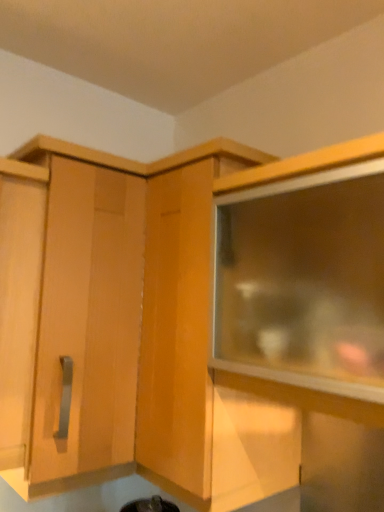
Describe the element at coordinates (304, 281) in the screenshot. I see `transparent glass cabinet at upper right` at that location.

At what (x,y) coordinates should I click in order to perform the action: click on wooden cabinet at center, the 1th cabinetry viewed from the right. Please return your answer as a coordinate pair (x, y). Looking at the image, I should click on (129, 322).

Locate an element on the screen. Image resolution: width=384 pixels, height=512 pixels. matte wood cabinet at upper left, the 2th cabinetry viewed from the right is located at coordinates (88, 321).

Identify the location of transparent glass cabinet at upper right. The width and height of the screenshot is (384, 512). (304, 281).

Measure the distance from transparent glass cabinet at upper right to matte wood cabinet at upper left, placed as the first cabinetry when sorted from left to right.

transparent glass cabinet at upper right and matte wood cabinet at upper left, placed as the first cabinetry when sorted from left to right, are 38.91 centimeters apart.

From a real-world perspective, does transparent glass cabinet at upper right sit lower than matte wood cabinet at upper left, the 2th cabinetry viewed from the right?

No, from a real-world perspective, transparent glass cabinet at upper right is not below matte wood cabinet at upper left, the 2th cabinetry viewed from the right.

Find the location of a particular element. cabinetry that is the 2nd one when counting leftward from the transparent glass cabinet at upper right is located at coordinates (88, 321).

Looking at the image, does transparent glass cabinet at upper right seem bigger or smaller compared to matte wood cabinet at upper left, placed as the first cabinetry when sorted from left to right?

Clearly, transparent glass cabinet at upper right is smaller in size than matte wood cabinet at upper left, placed as the first cabinetry when sorted from left to right.

The image size is (384, 512). Identify the location of cabinetry on the right of matte wood cabinet at upper left, placed as the first cabinetry when sorted from left to right. (129, 322).

Is wooden cabinet at center, the 2th cabinetry viewed from the left, positioned with its back to matte wood cabinet at upper left, placed as the first cabinetry when sorted from left to right?

Absolutely, wooden cabinet at center, the 2th cabinetry viewed from the left, is directed away from matte wood cabinet at upper left, placed as the first cabinetry when sorted from left to right.

Is wooden cabinet at center, the 1th cabinetry viewed from the right, taller than matte wood cabinet at upper left, the 2th cabinetry viewed from the right?

Correct, wooden cabinet at center, the 1th cabinetry viewed from the right, is much taller as matte wood cabinet at upper left, the 2th cabinetry viewed from the right.

From a real-world perspective, is wooden cabinet at center, the 2th cabinetry viewed from the left, positioned above or below matte wood cabinet at upper left, the 2th cabinetry viewed from the right?

wooden cabinet at center, the 2th cabinetry viewed from the left, is below matte wood cabinet at upper left, the 2th cabinetry viewed from the right.

Would you consider matte wood cabinet at upper left, the 2th cabinetry viewed from the right, to be distant from wooden cabinet at center, the 1th cabinetry viewed from the right?

matte wood cabinet at upper left, the 2th cabinetry viewed from the right, is near wooden cabinet at center, the 1th cabinetry viewed from the right, not far away.

This screenshot has width=384, height=512. Find the location of `cabinetry on the left of wooden cabinet at center, the 1th cabinetry viewed from the right`. cabinetry on the left of wooden cabinet at center, the 1th cabinetry viewed from the right is located at coordinates (88, 321).

From the image's perspective, which one is positioned lower, matte wood cabinet at upper left, placed as the first cabinetry when sorted from left to right, or wooden cabinet at center, the 2th cabinetry viewed from the left?

wooden cabinet at center, the 2th cabinetry viewed from the left, appears lower in the image.

From the image's perspective, is matte wood cabinet at upper left, placed as the first cabinetry when sorted from left to right, on transparent glass cabinet at upper right?

No, from the image's perspective, matte wood cabinet at upper left, placed as the first cabinetry when sorted from left to right, is not on top of transparent glass cabinet at upper right.

Considering the sizes of matte wood cabinet at upper left, the 2th cabinetry viewed from the right, and transparent glass cabinet at upper right in the image, is matte wood cabinet at upper left, the 2th cabinetry viewed from the right, taller or shorter than transparent glass cabinet at upper right?

In the image, matte wood cabinet at upper left, the 2th cabinetry viewed from the right, appears to be taller than transparent glass cabinet at upper right.

Is matte wood cabinet at upper left, placed as the first cabinetry when sorted from left to right, not inside transparent glass cabinet at upper right?

Yes, matte wood cabinet at upper left, placed as the first cabinetry when sorted from left to right, is not within transparent glass cabinet at upper right.

Is matte wood cabinet at upper left, the 2th cabinetry viewed from the right, in contact with transparent glass cabinet at upper right?

No, matte wood cabinet at upper left, the 2th cabinetry viewed from the right, is not in contact with transparent glass cabinet at upper right.

Is point (284, 180) farther from camera compared to point (102, 433)?

No, (284, 180) is in front of (102, 433).

Looking at this image, could you tell me if transparent glass cabinet at upper right is facing wooden cabinet at center, the 2th cabinetry viewed from the left?

No, transparent glass cabinet at upper right is not aimed at wooden cabinet at center, the 2th cabinetry viewed from the left.

Which object is positioned more to the left, transparent glass cabinet at upper right or wooden cabinet at center, the 1th cabinetry viewed from the right?

Positioned to the left is wooden cabinet at center, the 1th cabinetry viewed from the right.

In the scene shown: From the image's perspective, does transparent glass cabinet at upper right appear higher than wooden cabinet at center, the 1th cabinetry viewed from the right?

Correct, transparent glass cabinet at upper right appears higher than wooden cabinet at center, the 1th cabinetry viewed from the right, in the image.

Is transparent glass cabinet at upper right surrounded by wooden cabinet at center, the 1th cabinetry viewed from the right?

No, transparent glass cabinet at upper right is not surrounded by wooden cabinet at center, the 1th cabinetry viewed from the right.

Between wooden cabinet at center, the 1th cabinetry viewed from the right, and transparent glass cabinet at upper right, which one has less height?

transparent glass cabinet at upper right is shorter.

Considering the relative positions of wooden cabinet at center, the 2th cabinetry viewed from the left, and transparent glass cabinet at upper right in the image provided, is wooden cabinet at center, the 2th cabinetry viewed from the left, in front of transparent glass cabinet at upper right?

That is False.

Where is `window that appears above the wooden cabinet at center, the 1th cabinetry viewed from the right (from a real-world perspective)`? The image size is (384, 512). window that appears above the wooden cabinet at center, the 1th cabinetry viewed from the right (from a real-world perspective) is located at coordinates (304, 281).

Identify the location of window above the matte wood cabinet at upper left, placed as the first cabinetry when sorted from left to right (from a real-world perspective). The image size is (384, 512). (304, 281).

Identify the location of cabinetry below the matte wood cabinet at upper left, placed as the first cabinetry when sorted from left to right (from a real-world perspective). (129, 322).

Considering their positions, is wooden cabinet at center, the 1th cabinetry viewed from the right, positioned further to transparent glass cabinet at upper right than matte wood cabinet at upper left, the 2th cabinetry viewed from the right?

matte wood cabinet at upper left, the 2th cabinetry viewed from the right, is further to transparent glass cabinet at upper right.

Looking at the image, which one is located closer to matte wood cabinet at upper left, placed as the first cabinetry when sorted from left to right, wooden cabinet at center, the 1th cabinetry viewed from the right, or transparent glass cabinet at upper right?

wooden cabinet at center, the 1th cabinetry viewed from the right, is positioned closer to the anchor matte wood cabinet at upper left, placed as the first cabinetry when sorted from left to right.

Considering their positions, is matte wood cabinet at upper left, placed as the first cabinetry when sorted from left to right, positioned closer to transparent glass cabinet at upper right than wooden cabinet at center, the 1th cabinetry viewed from the right?

The object closer to transparent glass cabinet at upper right is wooden cabinet at center, the 1th cabinetry viewed from the right.

Which object lies further to the anchor point wooden cabinet at center, the 1th cabinetry viewed from the right, matte wood cabinet at upper left, the 2th cabinetry viewed from the right, or transparent glass cabinet at upper right?

transparent glass cabinet at upper right is further to wooden cabinet at center, the 1th cabinetry viewed from the right.

Based on their spatial positions, is transparent glass cabinet at upper right or wooden cabinet at center, the 2th cabinetry viewed from the left, further from matte wood cabinet at upper left, the 2th cabinetry viewed from the right?

transparent glass cabinet at upper right is further to matte wood cabinet at upper left, the 2th cabinetry viewed from the right.

Considering their positions, is transparent glass cabinet at upper right positioned further to wooden cabinet at center, the 1th cabinetry viewed from the right, than matte wood cabinet at upper left, the 2th cabinetry viewed from the right?

Based on the image, transparent glass cabinet at upper right appears to be further to wooden cabinet at center, the 1th cabinetry viewed from the right.

I want to click on cabinetry between matte wood cabinet at upper left, placed as the first cabinetry when sorted from left to right, and transparent glass cabinet at upper right, in the horizontal direction, so click(129, 322).